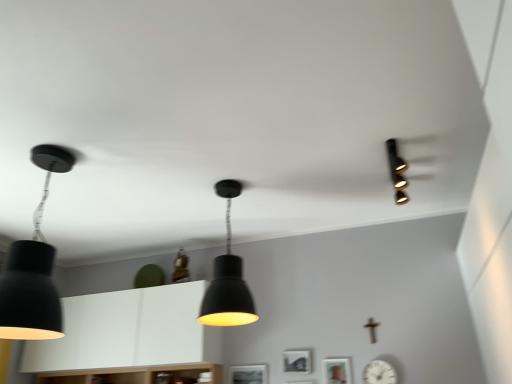
Question: From a real-world perspective, is matte black picture frame at center, the third picture frame in the right-to-left sequence, above or below white matte cabinet at center?

Choices:
 (A) below
 (B) above

Answer: (A)

Question: In terms of height, does matte black picture frame at center, the third picture frame in the right-to-left sequence, look taller or shorter compared to white matte cabinet at center?

Choices:
 (A) short
 (B) tall

Answer: (A)

Question: Which is nearer to the white matte cabinet at center?

Choices:
 (A) wooden picture frame at lower center, which is the third picture frame from left to right
 (B) black matte picture frame at center, placed as the 2th picture frame when sorted from left to right
 (C) matte black spotlight at upper right, which is counted as the third lamp, starting from the left
 (D) matte black lampshade at center, which is the second lamp in right-to-left order
 (E) matte black picture frame at center, positioned as the 1th picture frame in left-to-right order

Answer: (E)

Question: Which object is positioned closest to the white matte cabinet at center?

Choices:
 (A) white matte clock at lower right
 (B) matte black lampshade at center, which is the second lamp in right-to-left order
 (C) black matte picture frame at center, placed as the 2th picture frame when sorted from left to right
 (D) matte black pendant light at left, which is the third lamp in right-to-left order
 (E) matte black picture frame at center, positioned as the 1th picture frame in left-to-right order

Answer: (E)